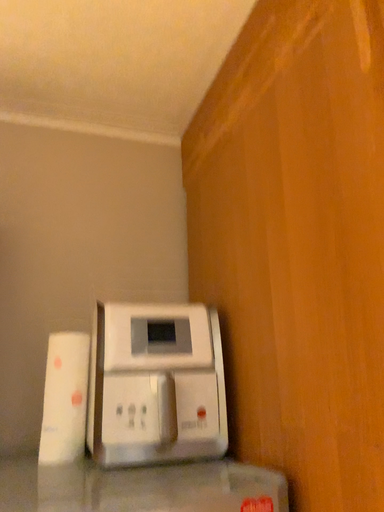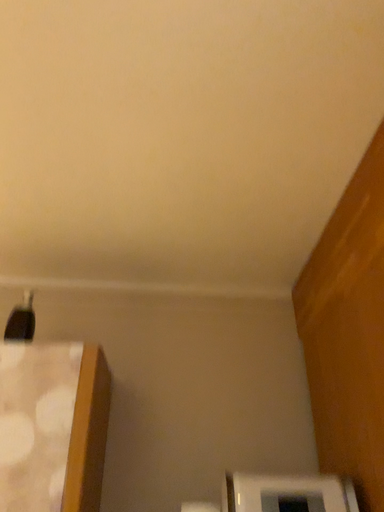
Question: How did the camera likely rotate when shooting the video?

Choices:
 (A) rotated left
 (B) rotated right

Answer: (A)